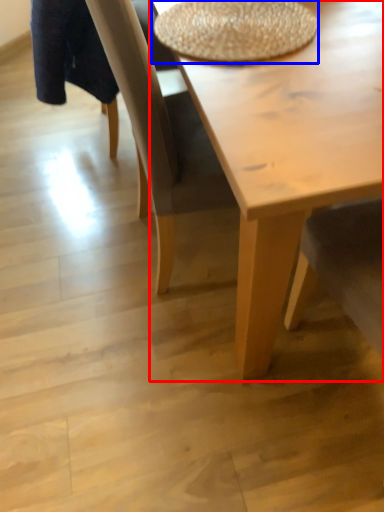
Question: Which object appears farthest to the camera in this image, coffee table (highlighted by a red box) or round table (highlighted by a blue box)?

Choices:
 (A) coffee table
 (B) round table

Answer: (B)